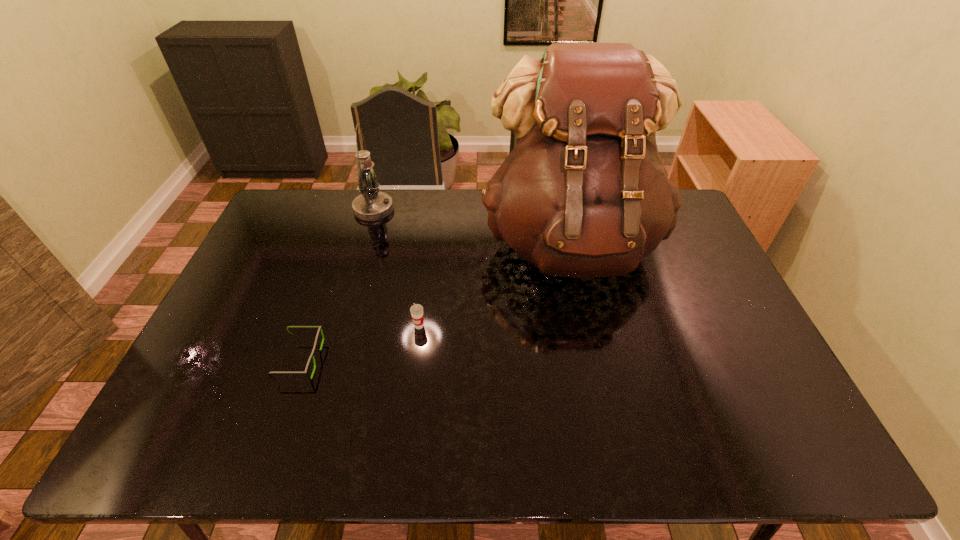
What are the coordinates of `object that is the second closest one to the tallest object` in the screenshot? It's located at (371, 205).

Find the location of a particular element. Image resolution: width=960 pixels, height=540 pixels. vacant region that satisfies the following two spatial constraints: 1. on the side of the second object from right to left with the logo; 2. on the lens of the nearest object is located at coordinates (415, 360).

At what (x,y) coordinates should I click in order to perform the action: click on free spot that satisfies the following two spatial constraints: 1. at the front of the satchel with buckles; 2. on the lens of the nearest object. Please return your answer as a coordinate pair (x, y). The image size is (960, 540). Looking at the image, I should click on (596, 360).

Where is `vacant space that satisfies the following two spatial constraints: 1. on the side of the second nearest object with the logo; 2. on the lens of the nearest object`? The height and width of the screenshot is (540, 960). vacant space that satisfies the following two spatial constraints: 1. on the side of the second nearest object with the logo; 2. on the lens of the nearest object is located at coordinates coord(415,360).

Identify the location of vacant position in the image that satisfies the following two spatial constraints: 1. on the front side of the second tallest object; 2. on the lens of the nearest object. (330, 360).